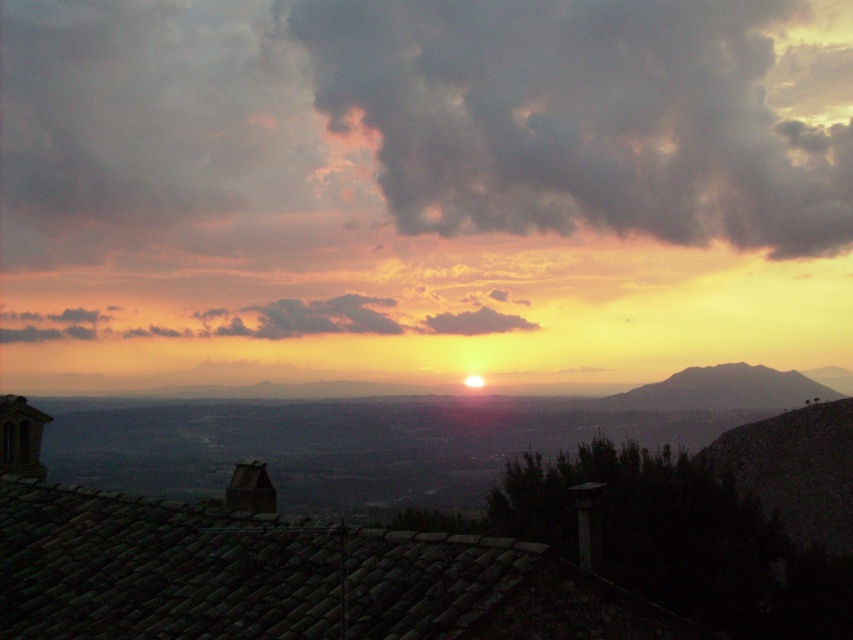
In the scene shown: Is cloudy sky at center taller than silhouetted rock formation at right?

Indeed, cloudy sky at center has a greater height compared to silhouetted rock formation at right.

Does cloudy sky at center have a lesser width compared to silhouetted rock formation at right?

Incorrect, cloudy sky at center's width is not less than silhouetted rock formation at right's.

Image resolution: width=853 pixels, height=640 pixels. I want to click on cloudy sky at center, so click(x=274, y=321).

You are a GUI agent. You are given a task and a screenshot of the screen. Output one action in this format:
    pyautogui.click(x=<x>, y=<y>)
    Task: Click on the cloudy sky at center
    This screenshot has width=853, height=640.
    Given the screenshot: What is the action you would take?
    pyautogui.click(x=274, y=321)

This screenshot has width=853, height=640. What do you see at coordinates (581, 118) in the screenshot?
I see `dark gray cloud at upper center` at bounding box center [581, 118].

Does point (386, 129) come behind point (383, 307)?

Yes.

Which is behind, point (668, 218) or point (360, 323)?

Point (668, 218)

At what (x,y) coordinates should I click in order to perform the action: click on dark gray cloud at upper center. Please return your answer as a coordinate pair (x, y). The image size is (853, 640). Looking at the image, I should click on (581, 118).

Is the position of dark gray cloud at upper center less distant than that of silhouetted rock formation at right?

No, dark gray cloud at upper center is further to the viewer.

You are a GUI agent. You are given a task and a screenshot of the screen. Output one action in this format:
    pyautogui.click(x=<x>, y=<y>)
    Task: Click on the dark gray cloud at upper center
    
    Given the screenshot: What is the action you would take?
    pyautogui.click(x=581, y=118)